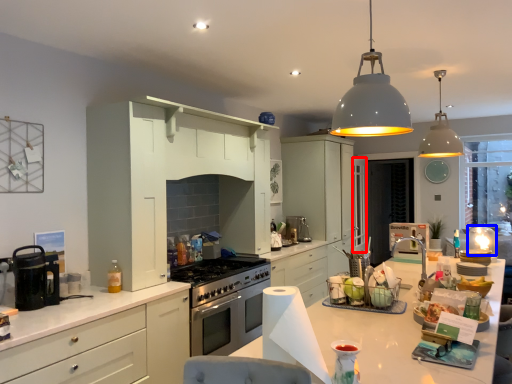
Question: Which point is closer to the camera, glass door (highlighted by a red box) or appliance (highlighted by a blue box)?

Choices:
 (A) glass door
 (B) appliance

Answer: (B)